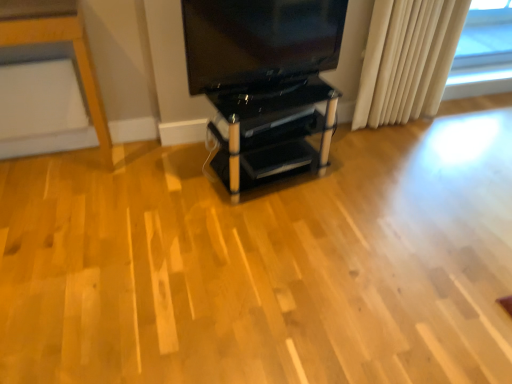
Question: Considering the relative sizes of white fabric curtain at right and black glass shelving unit at center in the image provided, is white fabric curtain at right shorter than black glass shelving unit at center?

Choices:
 (A) yes
 (B) no

Answer: (B)

Question: Can you confirm if white fabric curtain at right is wider than black glass shelving unit at center?

Choices:
 (A) no
 (B) yes

Answer: (A)

Question: From the image's perspective, is white fabric curtain at right on black glass shelving unit at center?

Choices:
 (A) yes
 (B) no

Answer: (A)

Question: From a real-world perspective, is white fabric curtain at right physically below black glass shelving unit at center?

Choices:
 (A) yes
 (B) no

Answer: (B)

Question: Does white fabric curtain at right have a smaller size compared to black glass shelving unit at center?

Choices:
 (A) no
 (B) yes

Answer: (B)

Question: From a real-world perspective, is matte black tv at upper center positioned above or below white fabric curtain at right?

Choices:
 (A) above
 (B) below

Answer: (A)

Question: Is matte black tv at upper center inside or outside of white fabric curtain at right?

Choices:
 (A) inside
 (B) outside

Answer: (B)

Question: Relative to white fabric curtain at right, is matte black tv at upper center in front or behind?

Choices:
 (A) front
 (B) behind

Answer: (A)

Question: Considering the positions of matte black tv at upper center and white fabric curtain at right in the image, is matte black tv at upper center taller or shorter than white fabric curtain at right?

Choices:
 (A) short
 (B) tall

Answer: (A)

Question: From a real-world perspective, relative to black glass shelving unit at center, is matte black tv at upper center vertically above or below?

Choices:
 (A) below
 (B) above

Answer: (B)

Question: Which is correct: matte black tv at upper center is inside black glass shelving unit at center, or outside of it?

Choices:
 (A) outside
 (B) inside

Answer: (A)

Question: Is matte black tv at upper center to the left or to the right of black glass shelving unit at center in the image?

Choices:
 (A) right
 (B) left

Answer: (B)

Question: Relative to black glass shelving unit at center, is matte black tv at upper center in front or behind?

Choices:
 (A) front
 (B) behind

Answer: (A)

Question: Is white fabric curtain at right inside the boundaries of matte black tv at upper center, or outside?

Choices:
 (A) outside
 (B) inside

Answer: (A)

Question: In the image, is white fabric curtain at right positioned in front of or behind matte black tv at upper center?

Choices:
 (A) behind
 (B) front

Answer: (A)